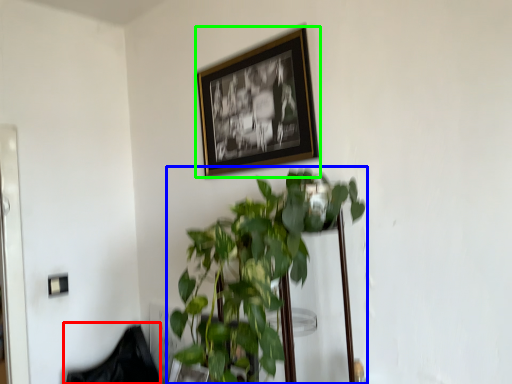
Question: Considering the real-world distances, which object is closest to swivel chair (highlighted by a red box)? houseplant (highlighted by a blue box) or picture frame (highlighted by a green box).

Choices:
 (A) houseplant
 (B) picture frame

Answer: (A)